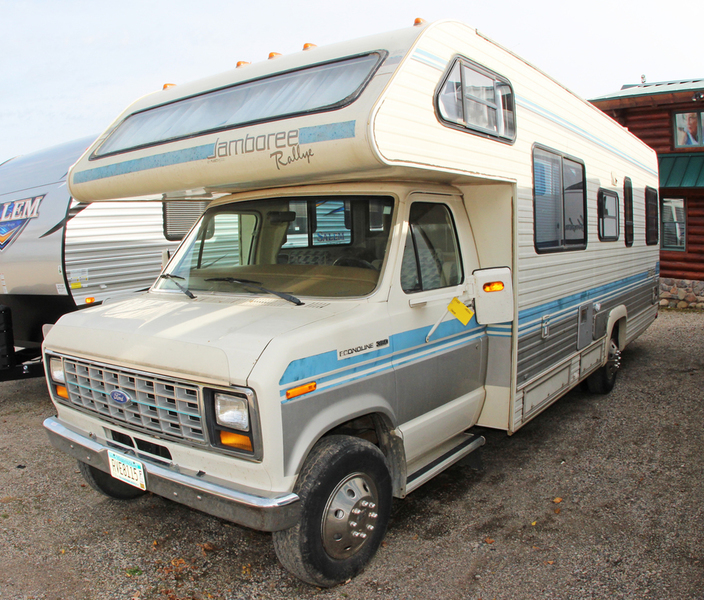
Find the location of a particular element. This screenshot has height=600, width=704. lights is located at coordinates (227, 418), (53, 369).